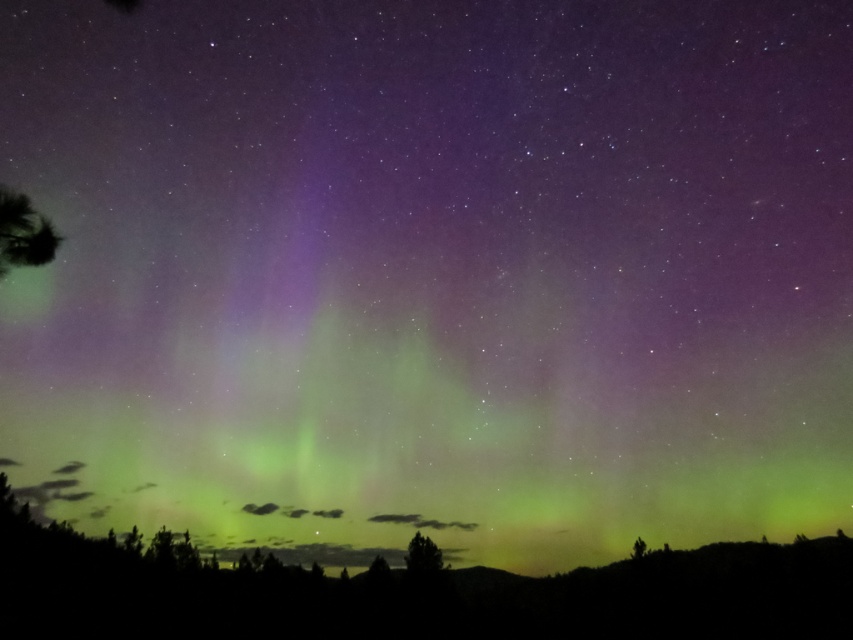
Question: Is green leafy tree at left to the left of green matte tree at lower center from the viewer's perspective?

Choices:
 (A) yes
 (B) no

Answer: (A)

Question: Is green matte tree at lower center smaller than green matte tree at lower right?

Choices:
 (A) yes
 (B) no

Answer: (A)

Question: Does green matte tree at lower center have a larger size compared to green matte tree at lower right?

Choices:
 (A) yes
 (B) no

Answer: (B)

Question: Which of these objects is positioned closest to the green matte tree at lower center?

Choices:
 (A) green leafy tree at left
 (B) green matte tree at lower right

Answer: (B)

Question: Estimate the real-world distances between objects in this image. Which object is closer to the green matte tree at lower center?

Choices:
 (A) green matte tree at lower right
 (B) green leafy tree at left

Answer: (A)

Question: Which object appears closest to the camera in this image?

Choices:
 (A) green leafy tree at left
 (B) green matte tree at lower right

Answer: (A)